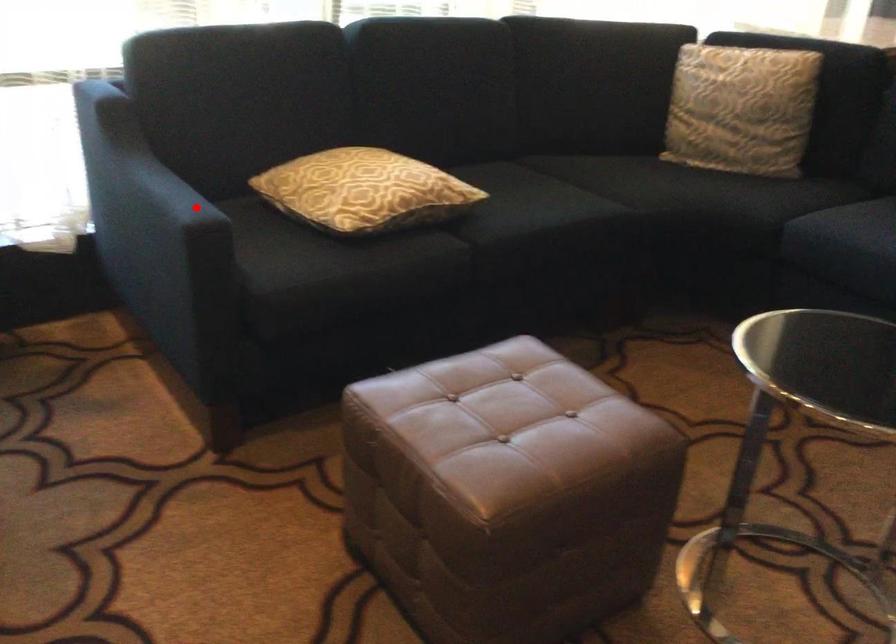
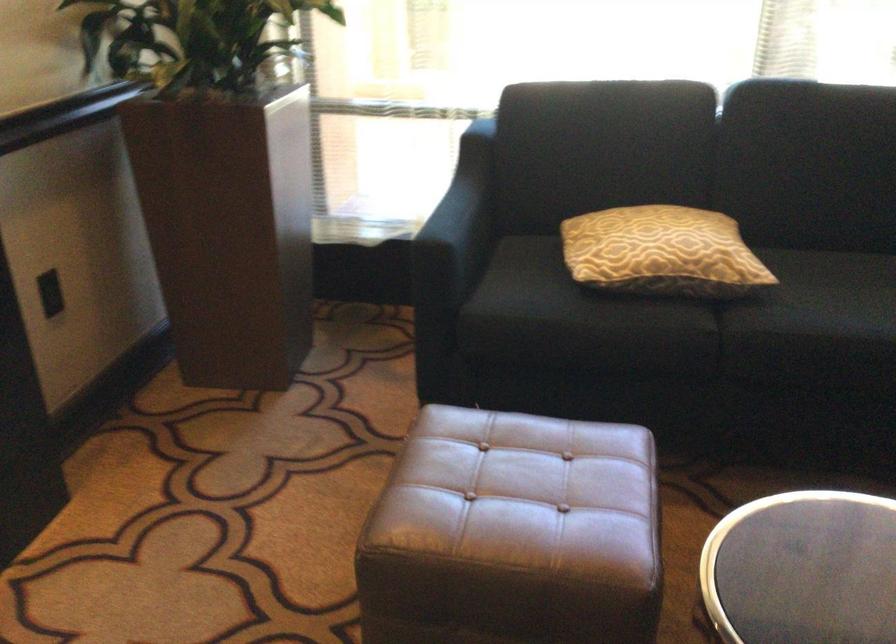
Question: I am providing you with two images of the same scene from different viewpoints. A red point is shown in image1. For the corresponding object point in image2, is it positioned nearer or farther from the camera?

Choices:
 (A) Nearer
 (B) Farther

Answer: (B)